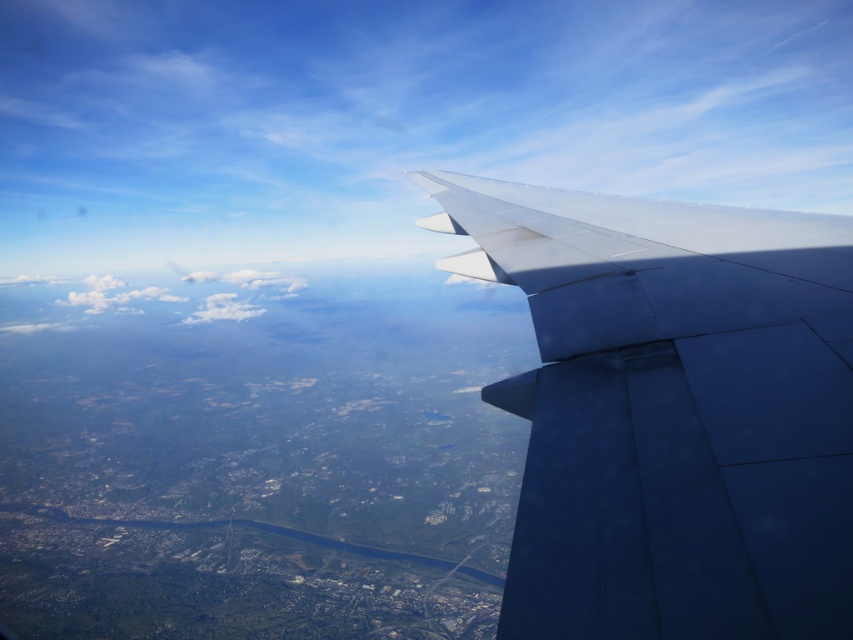
Who is positioned more to the right, satin blue wing at right or white fluffy cloud at center?

satin blue wing at right is more to the right.

Who is positioned more to the left, satin blue wing at right or white fluffy cloud at center?

Positioned to the left is white fluffy cloud at center.

Find the location of `satin blue wing at right`. satin blue wing at right is located at coordinates (671, 412).